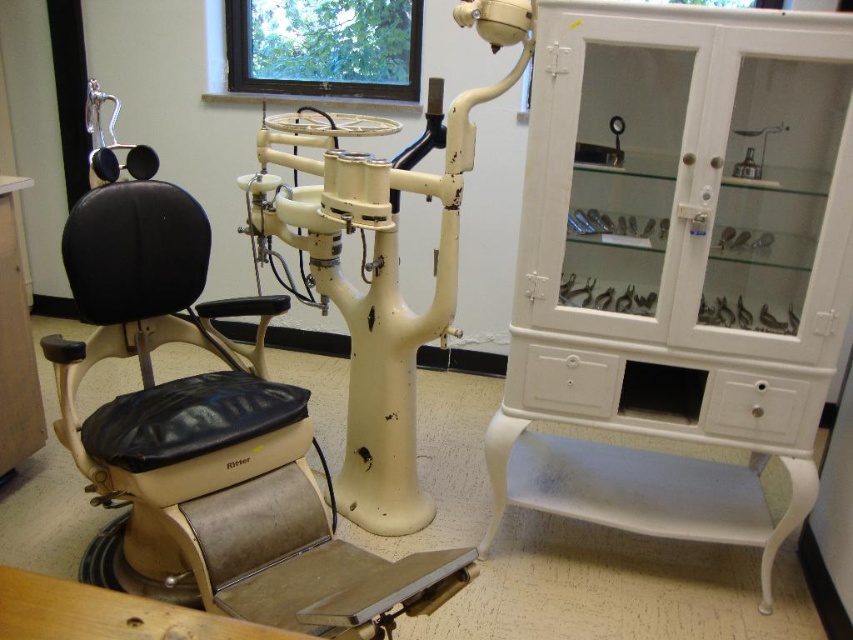
You are a dental assistant who needs to retrieve a tool from the white glossy cabinet at right. If you are standing 5 feet away from the cabinet, can you reach it without moving closer?

The white glossy cabinet at right is 5.17 feet away from the viewer. Since you are standing 5 feet away, you are already close enough to reach it without needing to move closer.

You are a dental assistant needing to retrieve a tool from the white glossy cabinet at right. You are currently standing next to the black leather swivel chair at left. Which direction should you move to reach the cabinet?

You should move to your right since the white glossy cabinet at right is located to the right of the black leather swivel chair at left.

You are a patient entering the dental office and see the black leather swivel chair at left and the matte cream dental chair at center. Which chair should you sit on first?

You should sit on the black leather swivel chair at left first because it is closer to you than the matte cream dental chair at center.